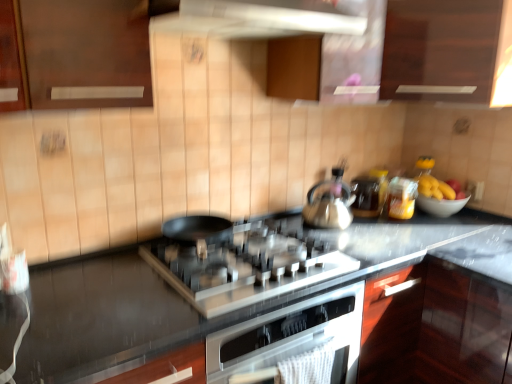
Question: From a real-world perspective, is matte yellow jar at upper right, which is the first appliance in right-to-left order, below matte glass jar at center, which is counted as the 2th appliance, starting from the right?

Choices:
 (A) yes
 (B) no

Answer: (B)

Question: From the image's perspective, is matte yellow jar at upper right, which is the first appliance in right-to-left order, below matte glass jar at center, acting as the first appliance starting from the left?

Choices:
 (A) yes
 (B) no

Answer: (A)

Question: Is matte yellow jar at upper right, the 2th appliance in the left-to-right sequence, taller than matte glass jar at center, which is counted as the 2th appliance, starting from the right?

Choices:
 (A) yes
 (B) no

Answer: (A)

Question: Is matte yellow jar at upper right, which is the first appliance in right-to-left order, not inside matte glass jar at center, acting as the first appliance starting from the left?

Choices:
 (A) yes
 (B) no

Answer: (A)

Question: Is matte yellow jar at upper right, the 2th appliance in the left-to-right sequence, to the left of matte glass jar at center, acting as the first appliance starting from the left, from the viewer's perspective?

Choices:
 (A) yes
 (B) no

Answer: (B)

Question: Considering the positions of matte yellow jar at upper right, which is the first appliance in right-to-left order, and white glossy bowl at right in the image, is matte yellow jar at upper right, which is the first appliance in right-to-left order, taller or shorter than white glossy bowl at right?

Choices:
 (A) tall
 (B) short

Answer: (A)

Question: In terms of size, does matte yellow jar at upper right, which is the first appliance in right-to-left order, appear bigger or smaller than white glossy bowl at right?

Choices:
 (A) big
 (B) small

Answer: (B)

Question: In terms of width, does matte yellow jar at upper right, which is the first appliance in right-to-left order, look wider or thinner when compared to white glossy bowl at right?

Choices:
 (A) thin
 (B) wide

Answer: (A)

Question: Does point (402, 203) appear closer or farther from the camera than point (434, 205)?

Choices:
 (A) farther
 (B) closer

Answer: (B)

Question: Is dark wood cabinet at upper center, acting as the 2th cabinetry starting from the left, wider or thinner than white glossy bowl at right?

Choices:
 (A) thin
 (B) wide

Answer: (B)

Question: Is dark wood cabinet at upper center, acting as the 2th cabinetry starting from the left, inside the boundaries of white glossy bowl at right, or outside?

Choices:
 (A) outside
 (B) inside

Answer: (A)

Question: Considering the relative positions of dark wood cabinet at upper center, acting as the first cabinetry starting from the right, and white glossy bowl at right in the image provided, is dark wood cabinet at upper center, acting as the first cabinetry starting from the right, to the left or to the right of white glossy bowl at right?

Choices:
 (A) right
 (B) left

Answer: (B)

Question: In the image, is dark wood cabinet at upper center, acting as the 2th cabinetry starting from the left, positioned in front of or behind white glossy bowl at right?

Choices:
 (A) front
 (B) behind

Answer: (A)

Question: From a real-world perspective, is matte yellow jar at upper right, which is the first appliance in right-to-left order, physically located above or below white glossy exhaust hood at upper center?

Choices:
 (A) above
 (B) below

Answer: (B)

Question: Based on their sizes in the image, would you say matte yellow jar at upper right, which is the first appliance in right-to-left order, is bigger or smaller than white glossy exhaust hood at upper center?

Choices:
 (A) big
 (B) small

Answer: (B)